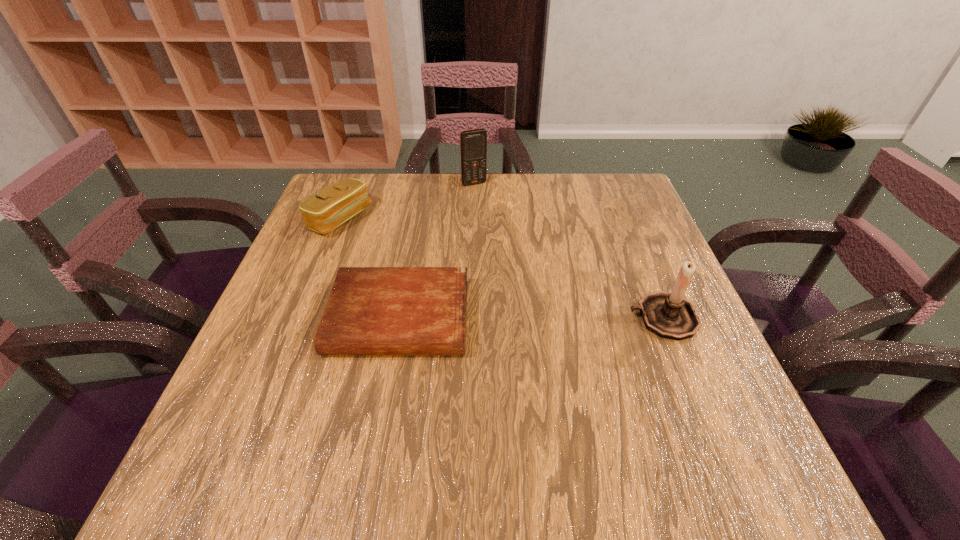
I want to click on vacant space at the left edge of the desktop, so click(287, 282).

The width and height of the screenshot is (960, 540). Find the location of `free space at the right edge`. free space at the right edge is located at coordinates (636, 234).

Identify the location of free spot at the far left corner of the desktop. The width and height of the screenshot is (960, 540). (371, 186).

This screenshot has width=960, height=540. Find the location of `free space at the near left corner of the desktop`. free space at the near left corner of the desktop is located at coordinates (307, 401).

In the image, there is a desktop. Where is `free space at the far right corner`? This screenshot has height=540, width=960. free space at the far right corner is located at coordinates (606, 195).

The width and height of the screenshot is (960, 540). I want to click on free point between the second farthest object and the farthest object, so 407,201.

I want to click on free space between the candle holder and the third nearest object, so click(500, 268).

Identify the location of free point between the farthest object and the second farthest object. This screenshot has height=540, width=960. (407, 201).

Find the location of a particular element. This screenshot has width=960, height=540. unoccupied position between the farthest object and the third nearest object is located at coordinates (407, 201).

Where is `free spot between the clutch bag and the rightmost object`? Image resolution: width=960 pixels, height=540 pixels. free spot between the clutch bag and the rightmost object is located at coordinates click(500, 268).